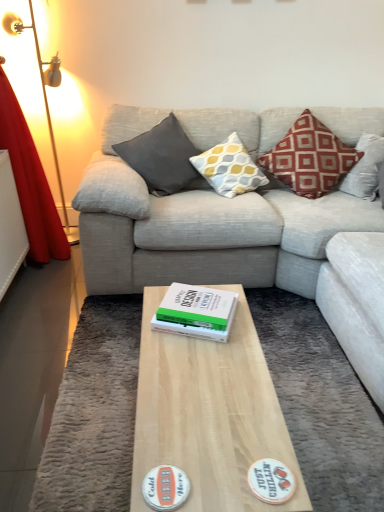
The image size is (384, 512). In order to click on vacant space to the right of light wood coffee table at center in this screenshot , I will do `click(327, 424)`.